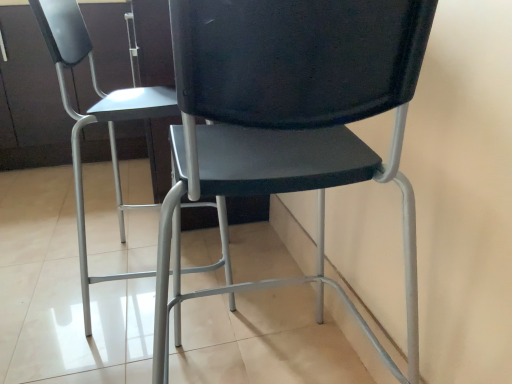
At what (x,y) coordinates should I click in order to perform the action: click on matte black chair at center, the second chair in the right-to-left sequence. Please return your answer as a coordinate pair (x, y). This screenshot has width=512, height=384. Looking at the image, I should click on (95, 114).

Describe the element at coordinates (95, 114) in the screenshot. I see `matte black chair at center, the second chair in the right-to-left sequence` at that location.

What do you see at coordinates (288, 116) in the screenshot? I see `matte black chair at center, the 1th chair in the right-to-left sequence` at bounding box center [288, 116].

Measure the distance between point (x=349, y=15) and camera.

Point (x=349, y=15) and camera are 19.92 inches apart from each other.

You are a GUI agent. You are given a task and a screenshot of the screen. Output one action in this format:
    pyautogui.click(x=<x>, y=<y>)
    Task: Click on the matte black chair at center, the second chair positioned from the left
    The height and width of the screenshot is (384, 512).
    Given the screenshot: What is the action you would take?
    pyautogui.click(x=288, y=116)

Where is `matte black chair at center, the first chair viewed from the left`? The width and height of the screenshot is (512, 384). matte black chair at center, the first chair viewed from the left is located at coordinates (95, 114).

Which is more to the left, matte black chair at center, the second chair in the right-to-left sequence, or matte black chair at center, the second chair positioned from the left?

From the viewer's perspective, matte black chair at center, the second chair in the right-to-left sequence, appears more on the left side.

From the picture: Considering the relative positions of matte black chair at center, the second chair in the right-to-left sequence, and matte black chair at center, the 1th chair in the right-to-left sequence, in the image provided, is matte black chair at center, the second chair in the right-to-left sequence, in front of matte black chair at center, the 1th chair in the right-to-left sequence,?

No, it is behind matte black chair at center, the 1th chair in the right-to-left sequence.

Is point (117, 176) closer to viewer compared to point (207, 14)?

No, it is not.

From the image's perspective, is matte black chair at center, the second chair in the right-to-left sequence, above or below matte black chair at center, the 1th chair in the right-to-left sequence?

From the image's perspective, matte black chair at center, the second chair in the right-to-left sequence, appears above matte black chair at center, the 1th chair in the right-to-left sequence.

From a real-world perspective, between matte black chair at center, the first chair viewed from the left, and matte black chair at center, the 1th chair in the right-to-left sequence, who is vertically higher?

From a 3D spatial view, matte black chair at center, the first chair viewed from the left, is above.

Is matte black chair at center, the first chair viewed from the left, wider or thinner than matte black chair at center, the 1th chair in the right-to-left sequence?

Clearly, matte black chair at center, the first chair viewed from the left, has more width compared to matte black chair at center, the 1th chair in the right-to-left sequence.

Can you confirm if matte black chair at center, the first chair viewed from the left, is taller than matte black chair at center, the 1th chair in the right-to-left sequence?

Correct, matte black chair at center, the first chair viewed from the left, is much taller as matte black chair at center, the 1th chair in the right-to-left sequence.

In terms of size, does matte black chair at center, the first chair viewed from the left, appear bigger or smaller than matte black chair at center, the second chair positioned from the left?

Clearly, matte black chair at center, the first chair viewed from the left, is larger in size than matte black chair at center, the second chair positioned from the left.

Consider the image. Would you say matte black chair at center, the second chair in the right-to-left sequence, contains matte black chair at center, the 1th chair in the right-to-left sequence?

Definitely not — matte black chair at center, the 1th chair in the right-to-left sequence, is not inside matte black chair at center, the second chair in the right-to-left sequence.

Is matte black chair at center, the second chair in the right-to-left sequence, not near matte black chair at center, the second chair positioned from the left?

No, matte black chair at center, the second chair in the right-to-left sequence, is not far away from matte black chair at center, the second chair positioned from the left.

Is matte black chair at center, the 1th chair in the right-to-left sequence, at the back of matte black chair at center, the first chair viewed from the left?

No.

Can you tell me how much matte black chair at center, the first chair viewed from the left, and matte black chair at center, the second chair positioned from the left, differ in facing direction?

The angle between the facing direction of matte black chair at center, the first chair viewed from the left, and the facing direction of matte black chair at center, the second chair positioned from the left, is 96.1 degrees.

Locate an element on the screen. Image resolution: width=512 pixels, height=384 pixels. chair behind the matte black chair at center, the second chair positioned from the left is located at coordinates (95, 114).

Considering the relative positions of matte black chair at center, the 1th chair in the right-to-left sequence, and matte black chair at center, the first chair viewed from the left, in the image provided, is matte black chair at center, the 1th chair in the right-to-left sequence, to the left of matte black chair at center, the first chair viewed from the left, from the viewer's perspective?

Incorrect, matte black chair at center, the 1th chair in the right-to-left sequence, is not on the left side of matte black chair at center, the first chair viewed from the left.

Consider the image. Relative to matte black chair at center, the second chair in the right-to-left sequence, is matte black chair at center, the second chair positioned from the left, in front or behind?

matte black chair at center, the second chair positioned from the left, is in front of matte black chair at center, the second chair in the right-to-left sequence.

Between point (330, 12) and point (120, 107), which one is positioned behind?

Positioned behind is point (120, 107).

From the image's perspective, is matte black chair at center, the 1th chair in the right-to-left sequence, located above matte black chair at center, the second chair in the right-to-left sequence?

No, from the image's perspective, matte black chair at center, the 1th chair in the right-to-left sequence, is not on top of matte black chair at center, the second chair in the right-to-left sequence.

From a real-world perspective, which is physically above, matte black chair at center, the 1th chair in the right-to-left sequence, or matte black chair at center, the first chair viewed from the left?

In real-world perspective, matte black chair at center, the first chair viewed from the left, is above.

Does matte black chair at center, the second chair positioned from the left, have a lesser width compared to matte black chair at center, the first chair viewed from the left?

Indeed, matte black chair at center, the second chair positioned from the left, has a lesser width compared to matte black chair at center, the first chair viewed from the left.

Between matte black chair at center, the second chair positioned from the left, and matte black chair at center, the first chair viewed from the left, which one has more height?

Standing taller between the two is matte black chair at center, the first chair viewed from the left.

Is matte black chair at center, the second chair positioned from the left, smaller than matte black chair at center, the second chair in the right-to-left sequence?

Yes.

Is matte black chair at center, the second chair positioned from the left, surrounding matte black chair at center, the first chair viewed from the left?

No, matte black chair at center, the first chair viewed from the left, is not surrounded by matte black chair at center, the second chair positioned from the left.

Is matte black chair at center, the 1th chair in the right-to-left sequence, positioned far away from matte black chair at center, the first chair viewed from the left?

No, there isn't a large distance between matte black chair at center, the 1th chair in the right-to-left sequence, and matte black chair at center, the first chair viewed from the left.

Is matte black chair at center, the second chair positioned from the left, oriented towards matte black chair at center, the second chair in the right-to-left sequence?

Yes, matte black chair at center, the second chair positioned from the left, faces towards matte black chair at center, the second chair in the right-to-left sequence.

How distant is matte black chair at center, the 1th chair in the right-to-left sequence, from matte black chair at center, the second chair in the right-to-left sequence?

matte black chair at center, the 1th chair in the right-to-left sequence, is 18.01 inches away from matte black chair at center, the second chair in the right-to-left sequence.

Find the location of a particular element. chair above the matte black chair at center, the 1th chair in the right-to-left sequence (from the image's perspective) is located at coordinates (95, 114).

Locate an element on the screen. The image size is (512, 384). chair that appears below the matte black chair at center, the second chair in the right-to-left sequence (from a real-world perspective) is located at coordinates pos(288,116).

Where is `chair that is on the left side of matte black chair at center, the 1th chair in the right-to-left sequence`? Image resolution: width=512 pixels, height=384 pixels. chair that is on the left side of matte black chair at center, the 1th chair in the right-to-left sequence is located at coordinates click(x=95, y=114).